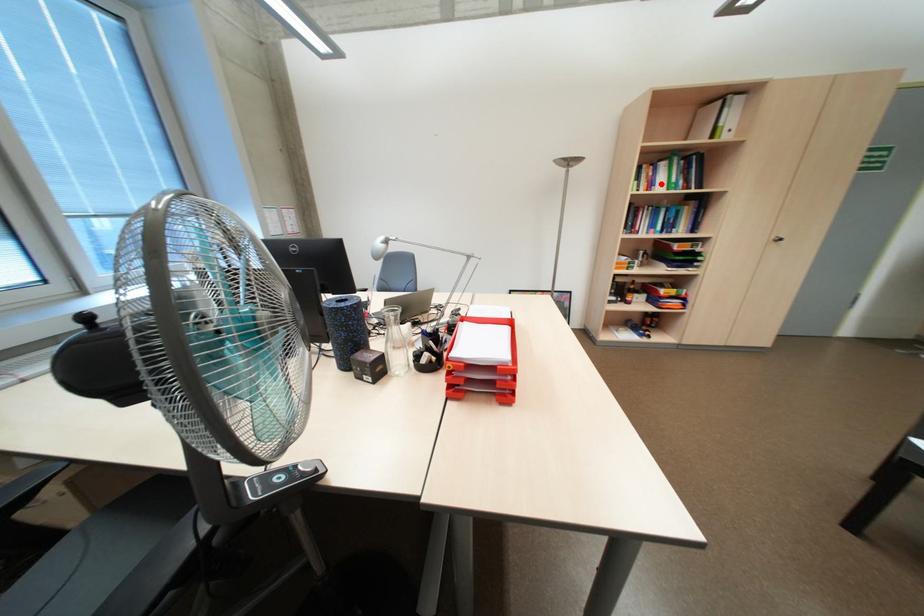
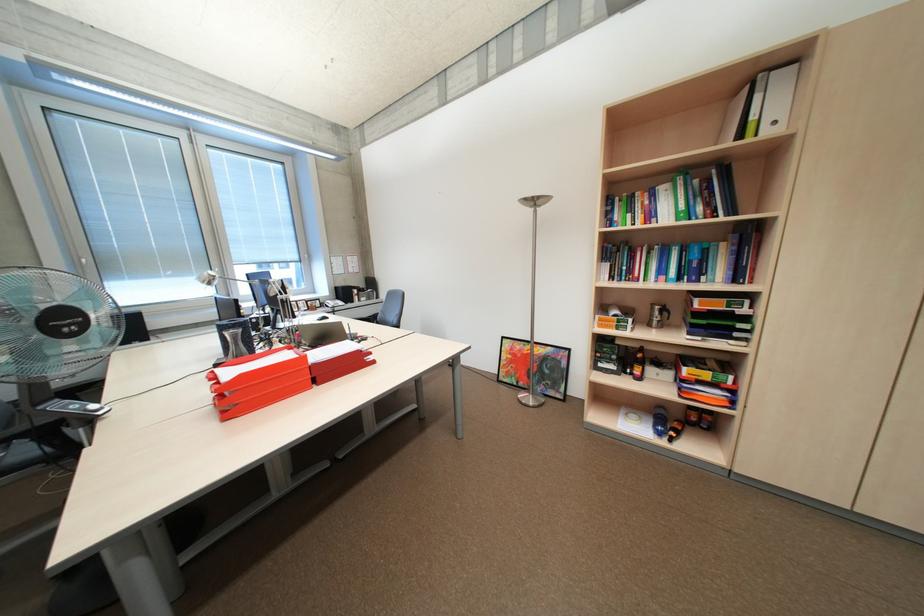
Where in the second image is the point corresponding to the highlighted location from the first image?

(661, 215)